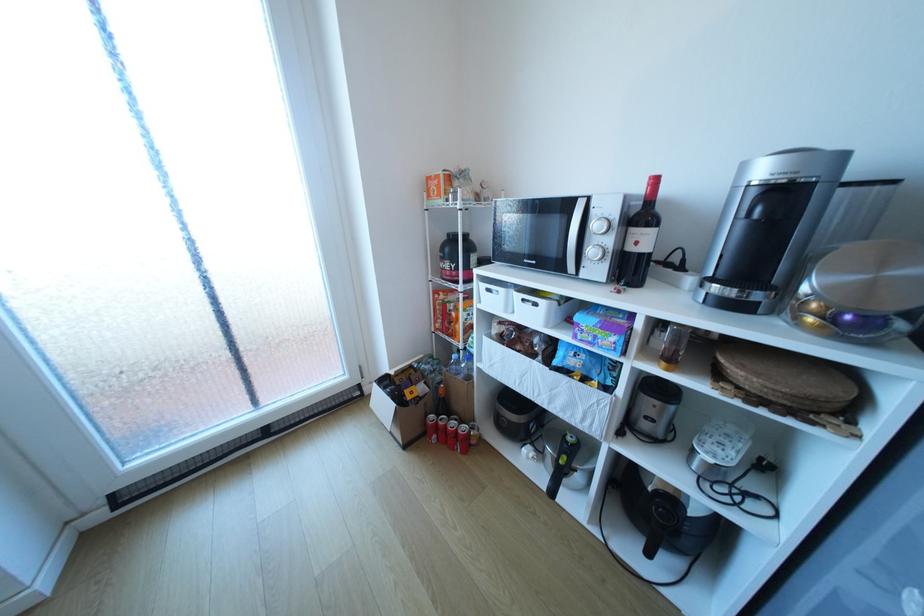
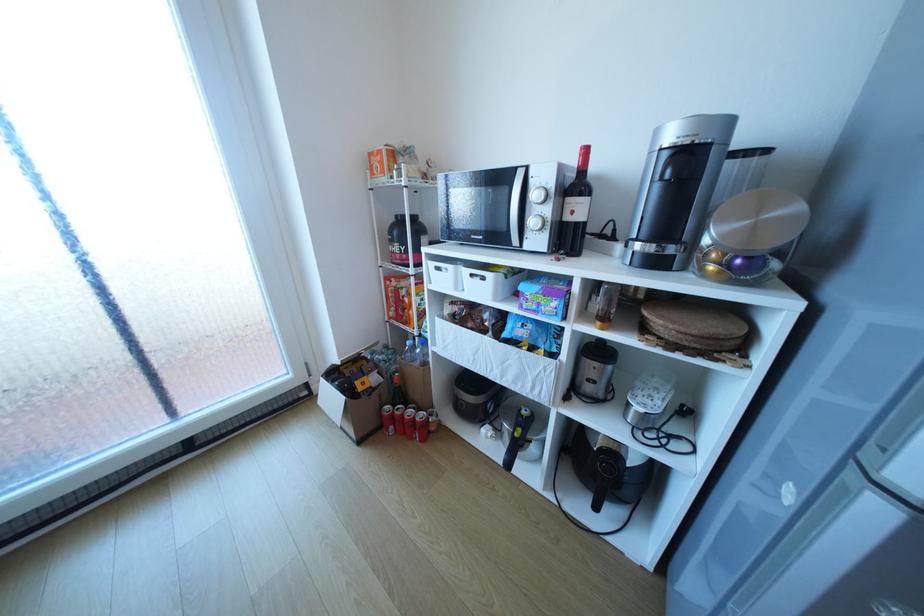
Locate, in the second image, the point that corresponds to (463,448) in the first image.

(420, 438)